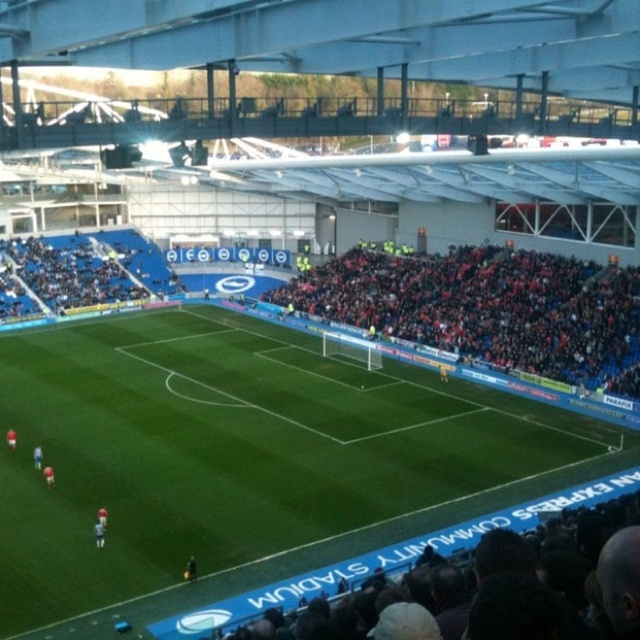
Who is positioned more to the right, green grass football field at center or red jersey at lower left?

green grass football field at center

Between green grass football field at center and red jersey at lower left, which one has more height?

Standing taller between the two is green grass football field at center.

Does point (282, 394) come closer to viewer compared to point (13, 440)?

That is False.

I want to click on green grass football field at center, so click(x=244, y=458).

Which of these two, blue jersey at center or white jersey player at center, stands shorter?

white jersey player at center is shorter.

Is point (100, 547) farther from camera compared to point (49, 472)?

No, (100, 547) is in front of (49, 472).

Between point (99, 545) and point (45, 484), which one is positioned behind?

Positioned behind is point (45, 484).

Find the location of a particular element. The image size is (640, 640). blue jersey at center is located at coordinates (99, 532).

How distant is red fabric crowd at center from white matte soccer player at lower left?

red fabric crowd at center and white matte soccer player at lower left are 39.32 meters apart from each other.

Find the location of `red fabric crowd at center`. red fabric crowd at center is located at coordinates (488, 308).

Who is more distant from viewer, (x=346, y=317) or (x=33, y=452)?

The point (x=346, y=317) is more distant.

Locate an element on the screen. red fabric crowd at center is located at coordinates (488, 308).